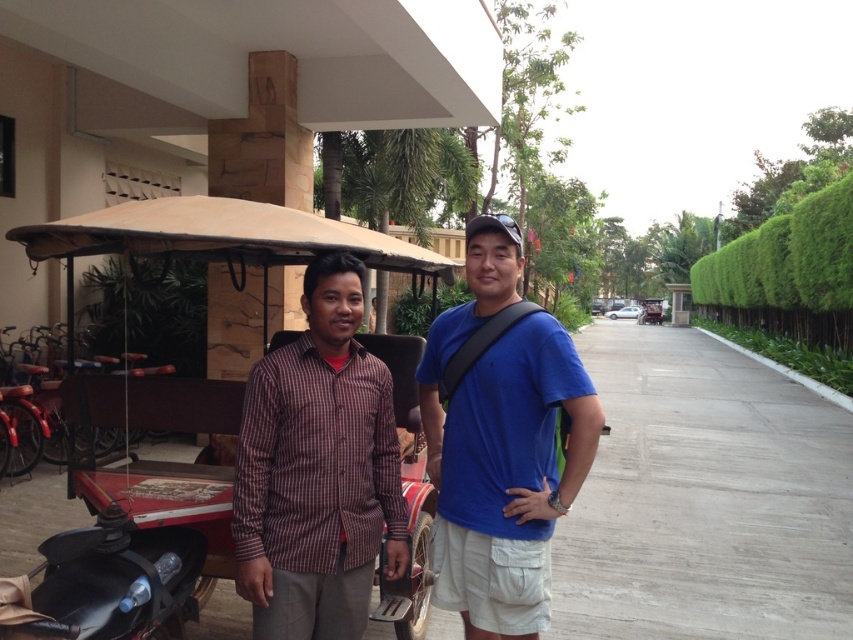
Question: Can you confirm if wooden cart at left is positioned above blue matte shirt at center?

Choices:
 (A) yes
 (B) no

Answer: (A)

Question: Is blue matte shirt at center smaller than brown checkered shirt at center?

Choices:
 (A) no
 (B) yes

Answer: (A)

Question: Which of the following is the farthest from the observer?

Choices:
 (A) (502, 296)
 (B) (419, 340)
 (C) (265, 560)

Answer: (B)

Question: Which point appears closest to the camera in this image?

Choices:
 (A) (97, 384)
 (B) (352, 448)

Answer: (B)

Question: Can you confirm if blue matte shirt at center is bigger than brown checkered shirt at center?

Choices:
 (A) yes
 (B) no

Answer: (A)

Question: Which point is farther to the camera?

Choices:
 (A) (502, 433)
 (B) (318, 368)
 (C) (125, 426)

Answer: (C)